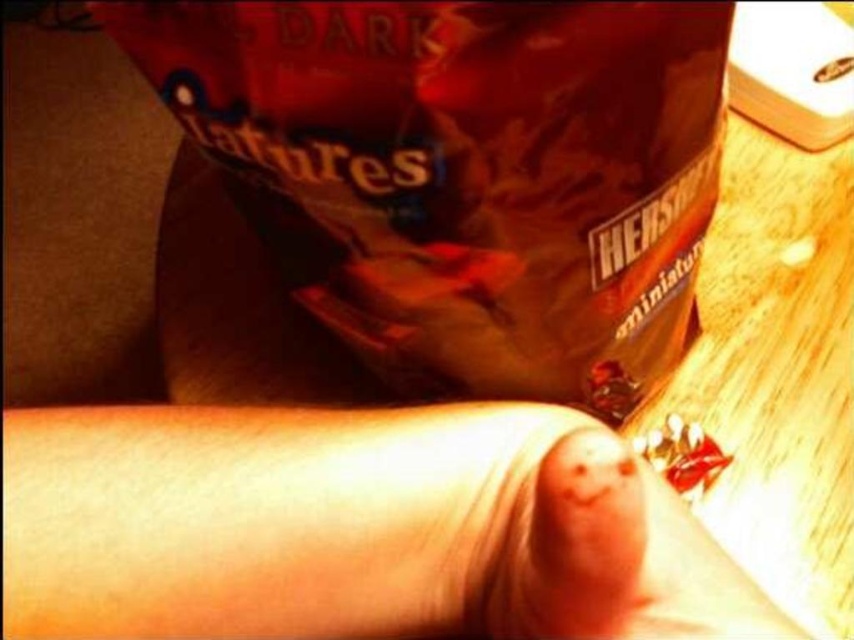
Question: Is brown matte bag at upper center thinner than smooth skin at center?

Choices:
 (A) yes
 (B) no

Answer: (B)

Question: Among these objects, which one is nearest to the camera?

Choices:
 (A) smooth skin at center
 (B) smooth skin finger at lower center

Answer: (B)

Question: Is brown matte bag at upper center above smooth skin at center?

Choices:
 (A) yes
 (B) no

Answer: (A)

Question: Is brown matte bag at upper center below smooth skin finger at lower center?

Choices:
 (A) no
 (B) yes

Answer: (A)

Question: Which point is closer to the camera taking this photo?

Choices:
 (A) (606, 449)
 (B) (217, 93)

Answer: (A)

Question: Among these points, which one is farthest from the camera?

Choices:
 (A) (506, 324)
 (B) (589, 600)
 (C) (28, 536)

Answer: (A)